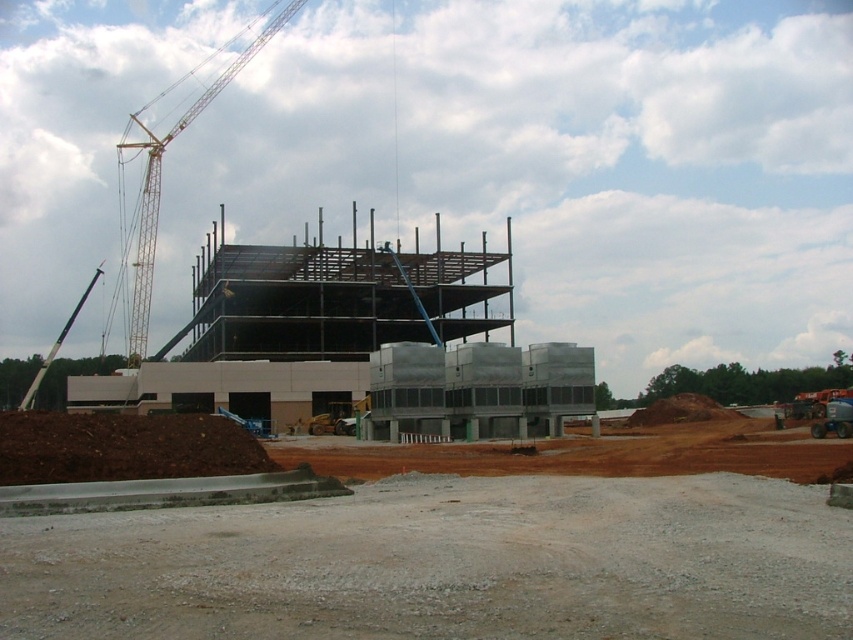
Question: Which of the following is the farthest from the observer?

Choices:
 (A) brown sandy dirt at lower center
 (B) gray gravel dirt track at lower center

Answer: (A)

Question: Does yellow metallic crane at upper left come behind white plastic website at center?

Choices:
 (A) yes
 (B) no

Answer: (A)

Question: Does brown sandy dirt at lower center have a greater width compared to yellow metallic crane at upper left?

Choices:
 (A) yes
 (B) no

Answer: (B)

Question: Is brown sandy dirt at lower center below white plastic website at center?

Choices:
 (A) yes
 (B) no

Answer: (B)

Question: Which point appears farthest from the camera in this image?

Choices:
 (A) (416, 438)
 (B) (302, 550)
 (C) (143, 211)
 (D) (788, 435)

Answer: (C)

Question: Which of the following is the closest to the observer?

Choices:
 (A) yellow metallic crane at upper left
 (B) brown sandy dirt at lower center
 (C) gray gravel dirt track at lower center
 (D) white plastic website at center

Answer: (C)